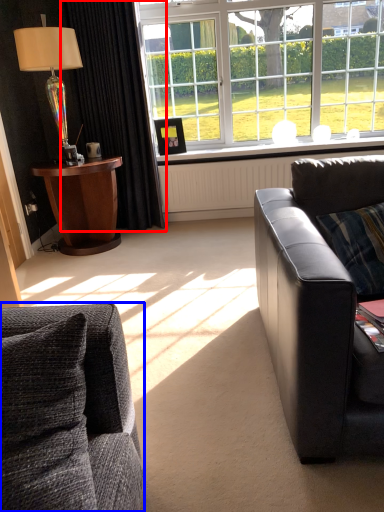
Question: Which point is closer to the camera, curtain (highlighted by a red box) or studio couch (highlighted by a blue box)?

Choices:
 (A) curtain
 (B) studio couch

Answer: (B)